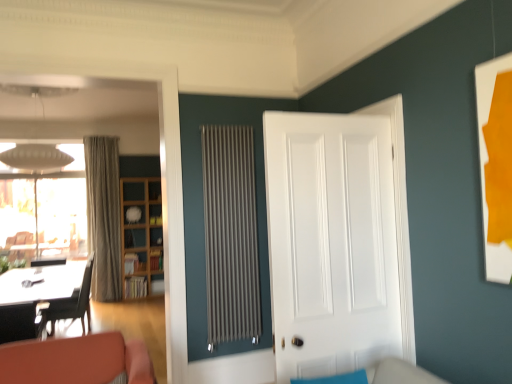
You are a GUI agent. You are given a task and a screenshot of the screen. Output one action in this format:
    pyautogui.click(x=<x>, y=<y>)
    Task: Click on the matte gray radiator at center
    This screenshot has width=512, height=384.
    Given the screenshot: What is the action you would take?
    [230, 234]

What do you see at coordinates (142, 237) in the screenshot? I see `woodenmaterial/texturebookshelf at left` at bounding box center [142, 237].

You are a GUI agent. You are given a task and a screenshot of the screen. Output one action in this format:
    pyautogui.click(x=<x>, y=<y>)
    Task: Click on the white smooth door at center
    This screenshot has height=384, width=512.
    Given the screenshot: What is the action you would take?
    pyautogui.click(x=338, y=239)

What is the approximate height of beige textured curtain at left?

9.63 feet.

Identify the location of teal fabric couch at lower center. Image resolution: width=512 pixels, height=384 pixels. (379, 375).

Which is more to the left, teal fabric couch at lower center or black leather chair at left?

black leather chair at left is more to the left.

Does teal fabric couch at lower center have a greater width compared to black leather chair at left?

No.

Is teal fabric couch at lower center bigger than black leather chair at left?

Actually, teal fabric couch at lower center might be smaller than black leather chair at left.

Is matte gray radiator at center aimed at white smooth door at center?

Yes, matte gray radiator at center is turned towards white smooth door at center.

Based on the photo, is white smooth door at center located within matte gray radiator at center?

No, white smooth door at center is not inside matte gray radiator at center.

Is matte gray radiator at center positioned far away from white smooth door at center?

Yes, matte gray radiator at center is far from white smooth door at center.

Is matte gray radiator at center taller or shorter than white smooth door at center?

Considering their sizes, matte gray radiator at center has more height than white smooth door at center.

Looking at their sizes, would you say transparent glass window at upper left is wider or thinner than beige textured curtain at left?

transparent glass window at upper left is thinner than beige textured curtain at left.

Is transparent glass window at upper left not inside beige textured curtain at left?

Absolutely, transparent glass window at upper left is external to beige textured curtain at left.

From a real-world perspective, which is physically below, transparent glass window at upper left or beige textured curtain at left?

transparent glass window at upper left, from a real-world perspective.

Considering the relative sizes of white glossy picture frame at right and transparent glass window at upper left in the image provided, is white glossy picture frame at right shorter than transparent glass window at upper left?

Correct, white glossy picture frame at right is not as tall as transparent glass window at upper left.

Is the position of white glossy picture frame at right more distant than that of transparent glass window at upper left?

No, white glossy picture frame at right is closer to the camera.

Does point (509, 93) come farther from viewer compared to point (65, 230)?

No, (509, 93) is in front of (65, 230).

In order to click on curtain that appears above the teal fabric couch at lower center (from a real-world perspective) in this screenshot , I will do `click(104, 216)`.

Does teal fabric couch at lower center have a greater width compared to beige textured curtain at left?

No, teal fabric couch at lower center is not wider than beige textured curtain at left.

Considering the relative sizes of teal fabric couch at lower center and beige textured curtain at left in the image provided, is teal fabric couch at lower center shorter than beige textured curtain at left?

Yes.

Which is behind, point (368, 376) or point (97, 184)?

Positioned behind is point (97, 184).

Who is smaller, woodenmaterial/texturebookshelf at left or transparent glass window at upper left?

woodenmaterial/texturebookshelf at left.

From a real-world perspective, is woodenmaterial/texturebookshelf at left on transparent glass window at upper left?

Actually, woodenmaterial/texturebookshelf at left is physically below transparent glass window at upper left in the real world.

The image size is (512, 384). Identify the location of bookshelf behind the transparent glass window at upper left. (142, 237).

In terms of height, does woodenmaterial/texturebookshelf at left look taller or shorter compared to transparent glass window at upper left?

woodenmaterial/texturebookshelf at left is shorter than transparent glass window at upper left.

From the picture: Is woodenmaterial/texturebookshelf at left turned away from beige textured curtain at left?

No, woodenmaterial/texturebookshelf at left's orientation is not away from beige textured curtain at left.

Can we say woodenmaterial/texturebookshelf at left lies outside beige textured curtain at left?

Indeed, woodenmaterial/texturebookshelf at left is completely outside beige textured curtain at left.

Is woodenmaterial/texturebookshelf at left to the right of beige textured curtain at left from the viewer's perspective?

Yes.

Which is in front, woodenmaterial/texturebookshelf at left or beige textured curtain at left?

beige textured curtain at left is more forward.

Where is `chair that is behind the teal fabric couch at lower center`? The image size is (512, 384). chair that is behind the teal fabric couch at lower center is located at coordinates (69, 306).

Locate an element on the screen. This screenshot has width=512, height=384. door below the matte gray radiator at center (from a real-world perspective) is located at coordinates (338, 239).

Based on their spatial positions, is white smooth door at center or woodenmaterial/texturebookshelf at left closer to transparent glass window at upper left?

woodenmaterial/texturebookshelf at left.

When comparing their distances from matte gray radiator at center, does beige textured curtain at left or transparent glass window at upper left seem further?

Based on the image, transparent glass window at upper left appears to be further to matte gray radiator at center.

Looking at the image, which one is located closer to transparent glass window at upper left, woodenmaterial/texturebookshelf at left or white smooth door at center?

Among the two, woodenmaterial/texturebookshelf at left is located nearer to transparent glass window at upper left.

When comparing their distances from matte gray radiator at center, does woodenmaterial/texturebookshelf at left or black leather chair at left seem further?

woodenmaterial/texturebookshelf at left.

Estimate the real-world distances between objects in this image. Which object is further from woodenmaterial/texturebookshelf at left, white smooth door at center or transparent glass window at upper left?

Based on the image, white smooth door at center appears to be further to woodenmaterial/texturebookshelf at left.

Which object lies nearer to the anchor point woodenmaterial/texturebookshelf at left, white glossy picture frame at right or black leather chair at left?

black leather chair at left lies closer to woodenmaterial/texturebookshelf at left than the other object.

When comparing their distances from woodenmaterial/texturebookshelf at left, does transparent glass window at upper left or white smooth door at center seem closer?

The object closer to woodenmaterial/texturebookshelf at left is transparent glass window at upper left.

Based on their spatial positions, is woodenmaterial/texturebookshelf at left or beige textured curtain at left closer to white smooth door at center?

woodenmaterial/texturebookshelf at left is positioned closer to the anchor white smooth door at center.

Where is `window positioned between teal fabric couch at lower center and woodenmaterial/texturebookshelf at left from near to far`? This screenshot has height=384, width=512. window positioned between teal fabric couch at lower center and woodenmaterial/texturebookshelf at left from near to far is located at coordinates (44, 209).

At what (x,y) coordinates should I click in order to perform the action: click on radiator between teal fabric couch at lower center and woodenmaterial/texturebookshelf at left along the z-axis. Please return your answer as a coordinate pair (x, y). The image size is (512, 384). Looking at the image, I should click on (230, 234).

Identify the location of chair positioned between white glossy picture frame at right and beige textured curtain at left from near to far. (69, 306).

Locate an element on the screen. The width and height of the screenshot is (512, 384). chair located between teal fabric couch at lower center and woodenmaterial/texturebookshelf at left in the depth direction is located at coordinates (69, 306).